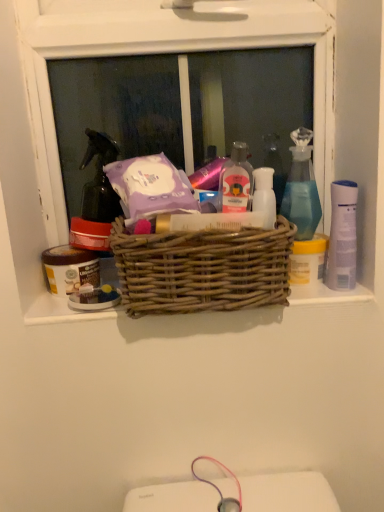
Question: Which direction should I rotate to look at translucent plastic bottle at center, which appears as the 2th toiletry when viewed from the right, — up or down?

Choices:
 (A) down
 (B) up

Answer: (B)

Question: From the image's perspective, is translucent plastic bottle at center, which is counted as the 3th toiletry, starting from the back, located beneath translucent glass spray bottle at upper right?

Choices:
 (A) no
 (B) yes

Answer: (B)

Question: From a real-world perspective, does translucent plastic bottle at center, which appears as the 2th toiletry when viewed from the right, stand above translucent glass spray bottle at upper right?

Choices:
 (A) no
 (B) yes

Answer: (B)

Question: Does translucent plastic bottle at center, which is counted as the 3th toiletry, starting from the back, appear on the left side of translucent glass spray bottle at upper right?

Choices:
 (A) no
 (B) yes

Answer: (B)

Question: Considering the relative sizes of translucent plastic bottle at center, which is counted as the 3th toiletry, starting from the back, and translucent glass spray bottle at upper right in the image provided, is translucent plastic bottle at center, which is counted as the 3th toiletry, starting from the back, smaller than translucent glass spray bottle at upper right?

Choices:
 (A) yes
 (B) no

Answer: (A)

Question: Is the surface of translucent plastic bottle at center, the first toiletry in the front-to-back sequence, in direct contact with translucent glass spray bottle at upper right?

Choices:
 (A) yes
 (B) no

Answer: (B)

Question: Is translucent plastic bottle at center, which is counted as the 3th toiletry, starting from the back, positioned behind translucent glass spray bottle at upper right?

Choices:
 (A) yes
 (B) no

Answer: (B)

Question: Is the position of matte brown jar at left, marked as the 3th toiletry in a right-to-left arrangement, more distant than that of translucent glass spray bottle at upper right?

Choices:
 (A) yes
 (B) no

Answer: (A)

Question: Does matte brown jar at left, which is the 3th toiletry from front to back, turn towards translucent glass spray bottle at upper right?

Choices:
 (A) yes
 (B) no

Answer: (B)

Question: Are matte brown jar at left, acting as the first toiletry starting from the back, and translucent glass spray bottle at upper right located far from each other?

Choices:
 (A) no
 (B) yes

Answer: (A)

Question: Is the depth of matte brown jar at left, acting as the first toiletry starting from the back, less than that of translucent glass spray bottle at upper right?

Choices:
 (A) yes
 (B) no

Answer: (B)

Question: Can you confirm if matte brown jar at left, the first toiletry positioned from the left, is smaller than translucent glass spray bottle at upper right?

Choices:
 (A) yes
 (B) no

Answer: (A)

Question: From the image's perspective, is matte brown jar at left, marked as the 3th toiletry in a right-to-left arrangement, on translucent glass spray bottle at upper right?

Choices:
 (A) no
 (B) yes

Answer: (A)

Question: Is white plastic bottle at center, the first toiletry positioned from the right, far away from woven wood basket at center?

Choices:
 (A) yes
 (B) no

Answer: (B)